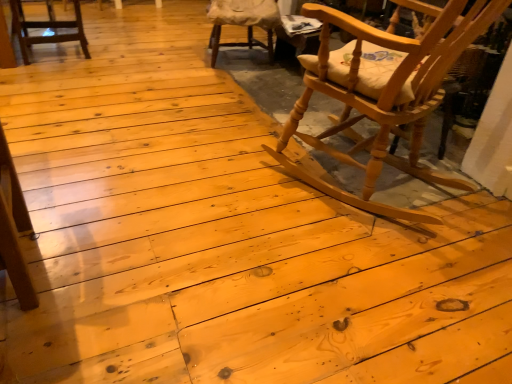
Locate an element on the screen. The width and height of the screenshot is (512, 384). free location in front of wooden cushioned chair at upper center, the 2th chair from the left is located at coordinates (221, 83).